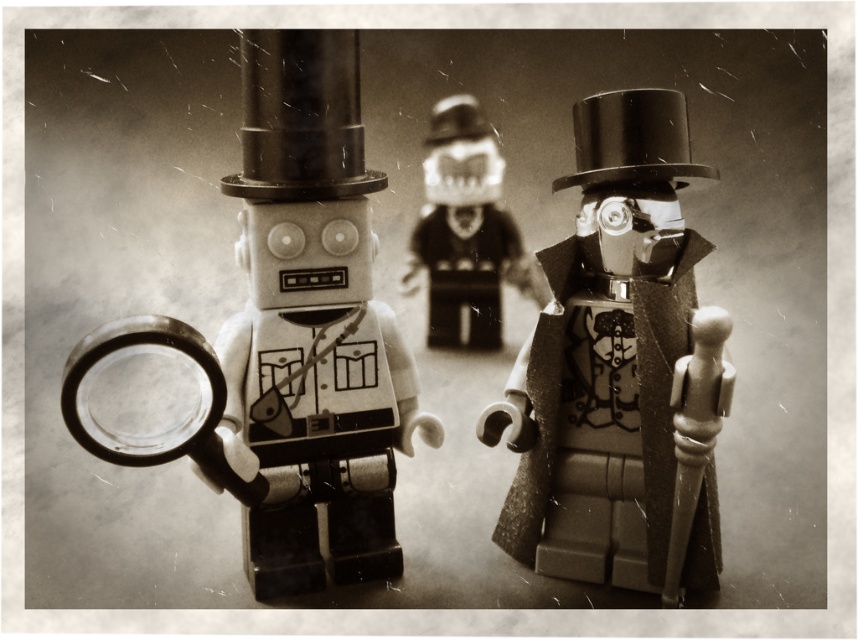
Between matte black top hat at center and smooth plastic figure at center, which one has less height?

Standing shorter between the two is smooth plastic figure at center.

Between point (579, 172) and point (494, 296), which one is positioned behind?

The point (494, 296) is more distant.

Between point (669, 394) and point (438, 250), which one is positioned behind?

Positioned behind is point (438, 250).

The image size is (858, 640). I want to click on matte black top hat at center, so click(618, 371).

Which is more to the right, smooth plastic figure at center or transparent plastic magnifying glass at left?

Positioned to the right is smooth plastic figure at center.

Looking at this image, which is below, smooth plastic figure at center or transparent plastic magnifying glass at left?

Positioned lower is transparent plastic magnifying glass at left.

Who is more forward, (503, 244) or (74, 368)?

Point (74, 368)

Where is `smooth plastic figure at center`? The width and height of the screenshot is (858, 640). smooth plastic figure at center is located at coordinates (466, 230).

Is matte plastic robot at left smaller than transparent plastic magnifying glass at left?

No.

In the scene shown: Is matte plastic robot at left to the left of transparent plastic magnifying glass at left from the viewer's perspective?

In fact, matte plastic robot at left is to the right of transparent plastic magnifying glass at left.

What do you see at coordinates (286, 339) in the screenshot?
I see `matte plastic robot at left` at bounding box center [286, 339].

Identify the location of matte plastic robot at left. The width and height of the screenshot is (858, 640). (286, 339).